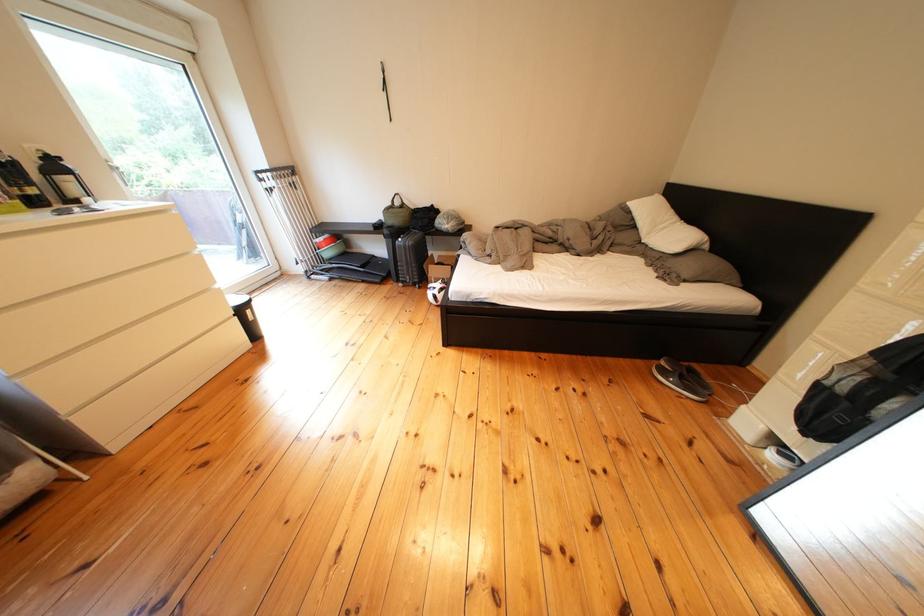
Where is `folding clothes rack`? This screenshot has height=616, width=924. folding clothes rack is located at coordinates (242, 233).